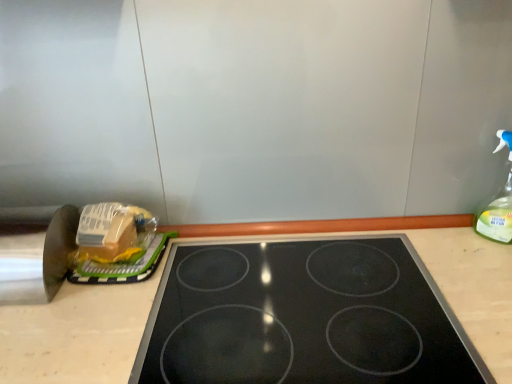
Question: Is clear plastic spray bottle at right bigger or smaller than translucent plastic bag at left?

Choices:
 (A) small
 (B) big

Answer: (A)

Question: Is clear plastic spray bottle at right wider or thinner than translucent plastic bag at left?

Choices:
 (A) thin
 (B) wide

Answer: (A)

Question: Which object is the closest to the black glass gas stove at center?

Choices:
 (A) translucent plastic bag at left
 (B) clear plastic spray bottle at right

Answer: (A)

Question: Which object is the farthest from the clear plastic spray bottle at right?

Choices:
 (A) black glass gas stove at center
 (B) translucent plastic bag at left

Answer: (B)